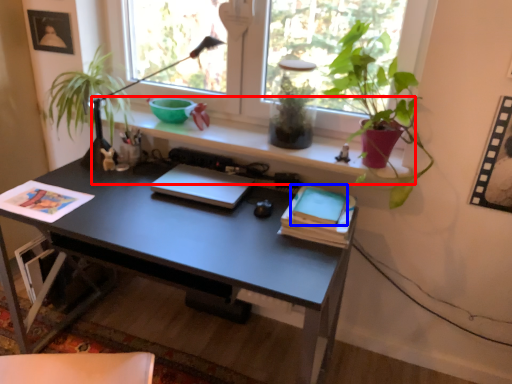
Question: Which of the following is the farthest to the observer, window sill (highlighted by a red box) or paperback book (highlighted by a blue box)?

Choices:
 (A) window sill
 (B) paperback book

Answer: (A)